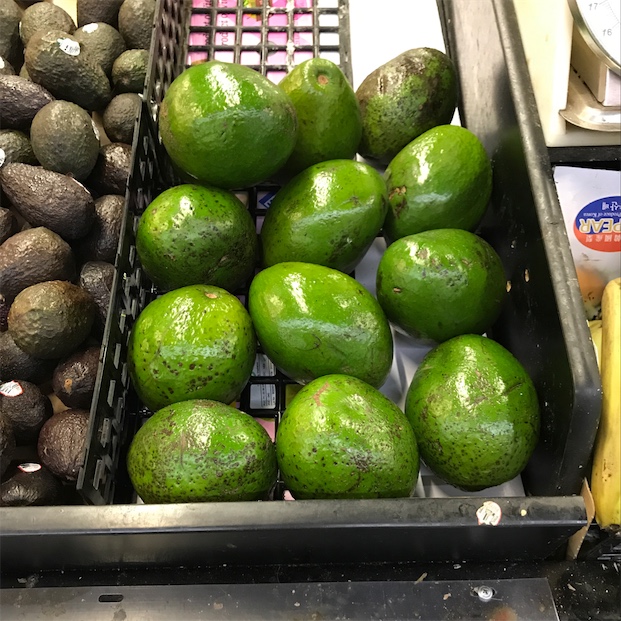
The height and width of the screenshot is (621, 621). Find the location of `metal scale base`. metal scale base is located at coordinates (589, 66).